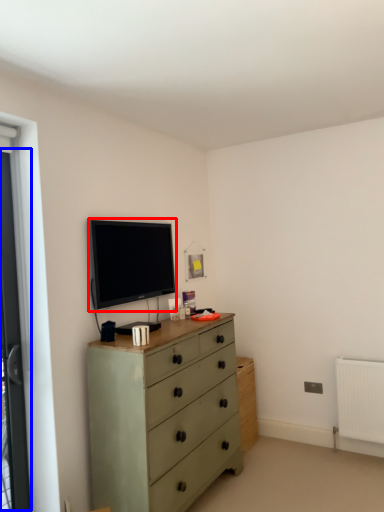
Question: Among these objects, which one is farthest to the camera, television (highlighted by a red box) or screen door (highlighted by a blue box)?

Choices:
 (A) television
 (B) screen door

Answer: (A)